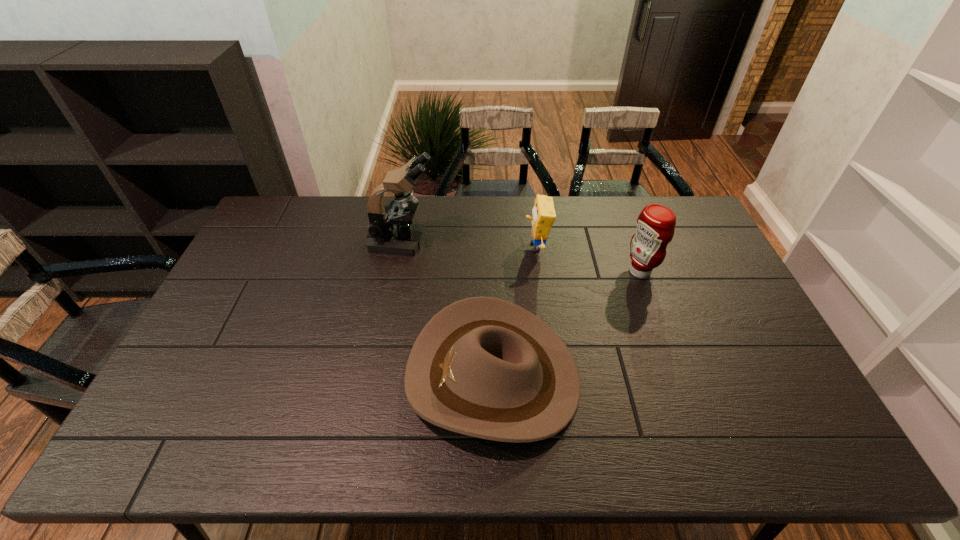
The width and height of the screenshot is (960, 540). Identify the location of vacant space located 0.230m with a star on the front of the cowboy hat. (318, 376).

Image resolution: width=960 pixels, height=540 pixels. I want to click on vacant area situated with a star on the front of the cowboy hat, so tap(261, 376).

Identify the location of vacant space located 0.130m with a star on the front of the cowboy hat. This screenshot has width=960, height=540. (356, 376).

What are the coordinates of `microscope that is at the far edge` in the screenshot? It's located at (391, 231).

At what (x,y) coordinates should I click in order to perform the action: click on sponge positioned at the far edge. Please return your answer as a coordinate pair (x, y). The image size is (960, 540). Looking at the image, I should click on (543, 213).

This screenshot has width=960, height=540. What are the coordinates of `object situated at the near edge` in the screenshot? It's located at (484, 367).

Locate an element on the screen. Image resolution: width=960 pixels, height=540 pixels. vacant space at the far edge is located at coordinates (612, 210).

The height and width of the screenshot is (540, 960). I want to click on free space at the near edge of the desktop, so click(347, 454).

The image size is (960, 540). I want to click on vacant space at the left edge of the desktop, so click(x=245, y=253).

This screenshot has width=960, height=540. In order to click on vacant space at the right edge of the desktop in this screenshot , I will do `click(734, 309)`.